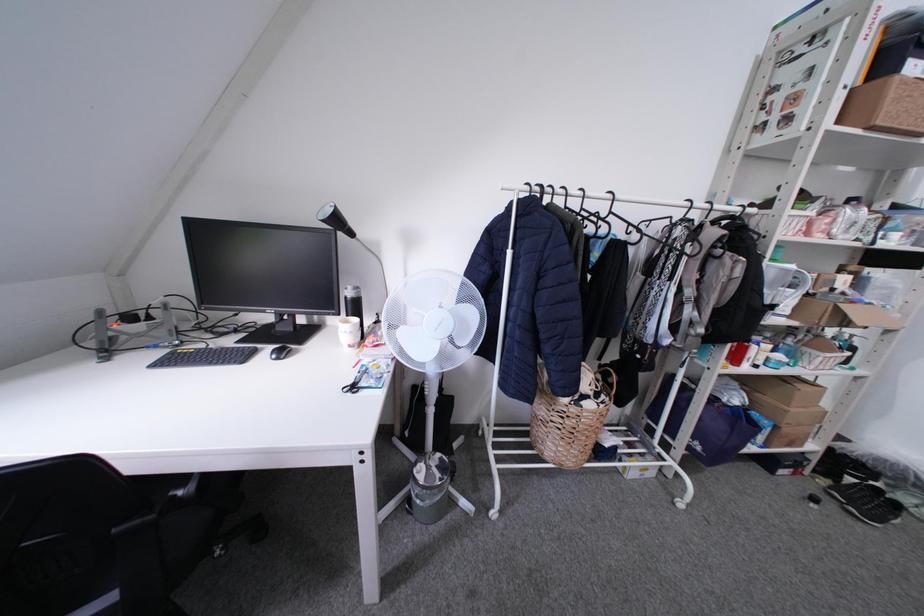
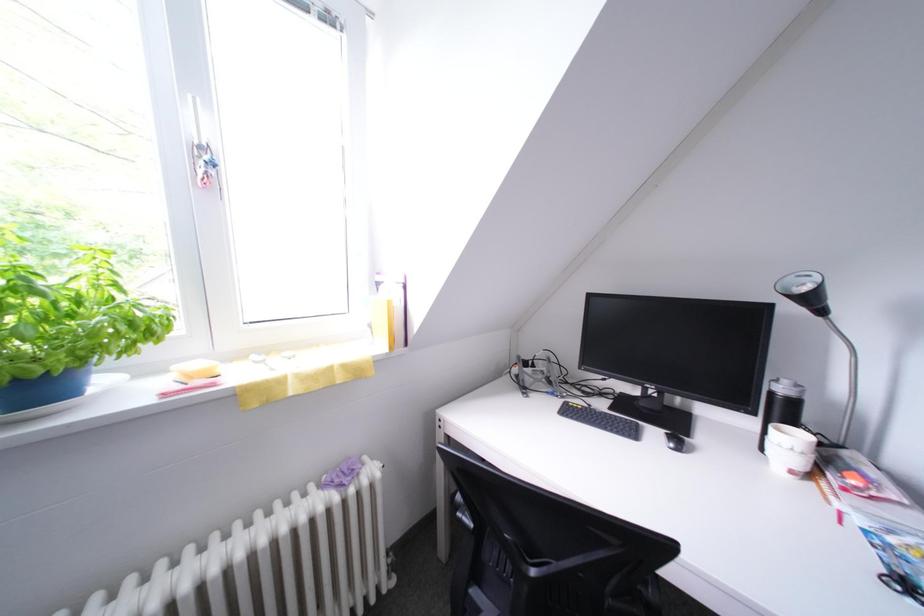
Question: The first image is from the beginning of the video and the second image is from the end. How did the camera likely rotate when shooting the video?

Choices:
 (A) Left
 (B) Right
 (C) Up
 (D) Down

Answer: (A)